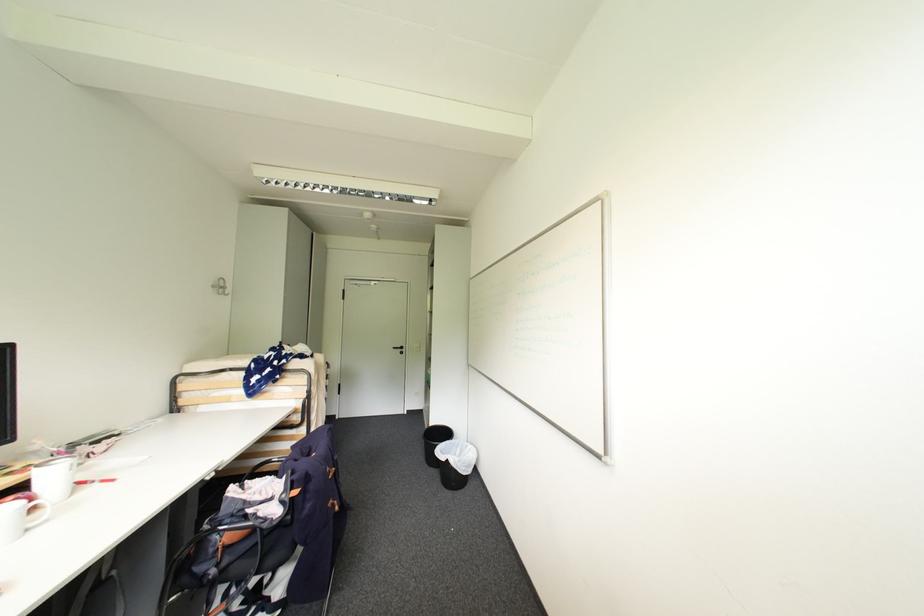
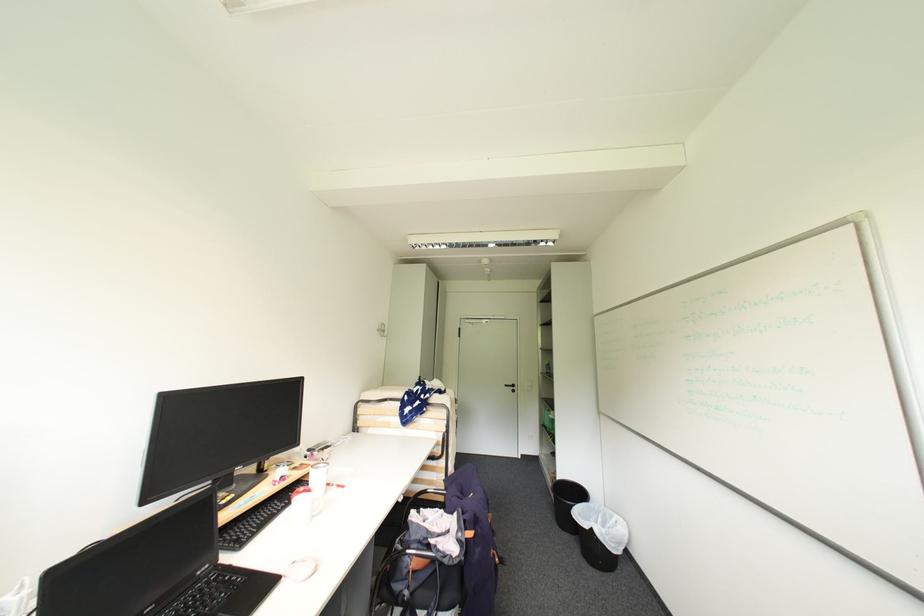
Find the pixel in the second image that matches the point at 456,442 in the first image.

(591, 505)